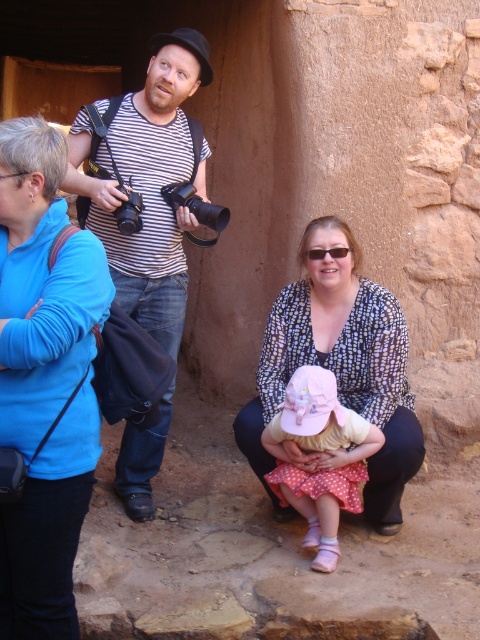
In the scene described, where is the striped cotton shirt at center in relation to the black plastic camera at center?

The striped cotton shirt at center is to the left of the black plastic camera at center.

Based on the scene description, which clothing item is positioned higher between the striped cotton shirt at center and the polka dot blouse at center?

The striped cotton shirt at center is positioned higher than the polka dot blouse at center.

Based on the scene description, can you determine the spatial relationship between the polka dot blouse at center and the black plastic camera at upper center?

The polka dot blouse at center is located below the black plastic camera at upper center.